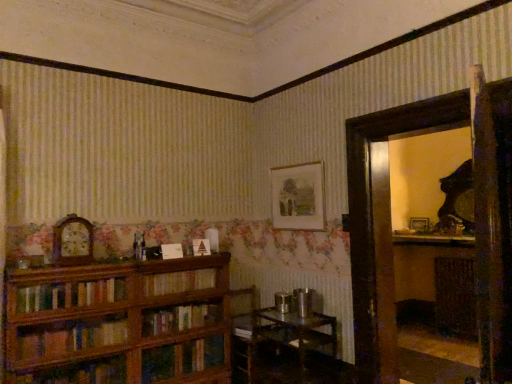
Locate an element on the screen. vacant space situated above matte paper picture frame at upper center, positioned as the 1th picture frame in top-to-bottom order (from a real-world perspective) is located at coordinates [x=296, y=164].